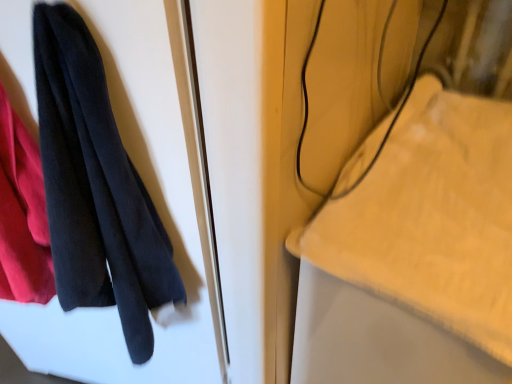
The height and width of the screenshot is (384, 512). I want to click on empty space that is ontop of yellow plush towel at upper right (from a real-world perspective), so click(445, 180).